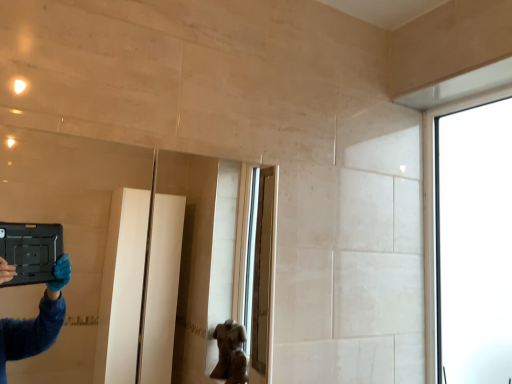
Measure the distance between point (93, 259) and camera.

They are 8.76 feet apart.

Locate an element on the screen. The image size is (512, 384). clear glass mirror at upper left is located at coordinates (83, 244).

What do you see at coordinates (83, 244) in the screenshot? I see `clear glass mirror at upper left` at bounding box center [83, 244].

What is the approximate width of transparent glass window at upper right?

It is 2.15 inches.

Describe the element at coordinates (471, 242) in the screenshot. I see `transparent glass window at upper right` at that location.

Find the location of a particular element. transparent glass window at upper right is located at coordinates (471, 242).

Locate an element on the screen. This screenshot has height=384, width=512. clear glass mirror at upper left is located at coordinates (83, 244).

Considering the relative positions of clear glass mirror at upper left and transparent glass window at upper right in the image provided, is clear glass mirror at upper left to the left of transparent glass window at upper right from the viewer's perspective?

Indeed, clear glass mirror at upper left is positioned on the left side of transparent glass window at upper right.

Does clear glass mirror at upper left lie behind transparent glass window at upper right?

That is False.

Considering the points (41, 371) and (452, 377), which point is behind, point (41, 371) or point (452, 377)?

The point (41, 371) is more distant.

From the image's perspective, is clear glass mirror at upper left over transparent glass window at upper right?

No, from the image's perspective, clear glass mirror at upper left is not on top of transparent glass window at upper right.

From a real-world perspective, which object stands above the other?

transparent glass window at upper right is physically above.

Considering the sizes of objects clear glass mirror at upper left and transparent glass window at upper right in the image provided, who is wider, clear glass mirror at upper left or transparent glass window at upper right?

clear glass mirror at upper left is wider.

Which of these two, clear glass mirror at upper left or transparent glass window at upper right, stands shorter?

clear glass mirror at upper left is shorter.

Considering the relative sizes of clear glass mirror at upper left and transparent glass window at upper right in the image provided, is clear glass mirror at upper left bigger than transparent glass window at upper right?

Yes, clear glass mirror at upper left is bigger than transparent glass window at upper right.

Which is correct: clear glass mirror at upper left is inside transparent glass window at upper right, or outside of it?

clear glass mirror at upper left exists outside the volume of transparent glass window at upper right.

Is clear glass mirror at upper left placed right next to transparent glass window at upper right?

clear glass mirror at upper left and transparent glass window at upper right are not in contact.

Is clear glass mirror at upper left looking in the opposite direction of transparent glass window at upper right?

No.

Find the location of a particular element. Image resolution: width=512 pixels, height=384 pixels. mirror below the transparent glass window at upper right (from the image's perspective) is located at coordinates (83, 244).

Which is more to the left, transparent glass window at upper right or clear glass mirror at upper left?

clear glass mirror at upper left is more to the left.

Relative to clear glass mirror at upper left, is transparent glass window at upper right in front or behind?

Clearly, transparent glass window at upper right is behind clear glass mirror at upper left.

Is point (449, 245) closer or farther from the camera than point (101, 355)?

Point (449, 245) appears to be closer to the viewer than point (101, 355).

From the image's perspective, does transparent glass window at upper right appear higher than clear glass mirror at upper left?

Correct, transparent glass window at upper right appears higher than clear glass mirror at upper left in the image.

From a real-world perspective, is transparent glass window at upper right positioned above or below clear glass mirror at upper left?

transparent glass window at upper right is situated higher than clear glass mirror at upper left in the real world.

Considering the relative sizes of transparent glass window at upper right and clear glass mirror at upper left in the image provided, is transparent glass window at upper right wider than clear glass mirror at upper left?

In fact, transparent glass window at upper right might be narrower than clear glass mirror at upper left.

From the picture: Considering the sizes of transparent glass window at upper right and clear glass mirror at upper left in the image, is transparent glass window at upper right taller or shorter than clear glass mirror at upper left?

transparent glass window at upper right is taller than clear glass mirror at upper left.

Which of these two, transparent glass window at upper right or clear glass mirror at upper left, is bigger?

Bigger between the two is clear glass mirror at upper left.

Would you say transparent glass window at upper right is outside clear glass mirror at upper left?

Absolutely, transparent glass window at upper right is external to clear glass mirror at upper left.

Are transparent glass window at upper right and clear glass mirror at upper left far apart?

That's right, there is a large distance between transparent glass window at upper right and clear glass mirror at upper left.

Is clear glass mirror at upper left at the back of transparent glass window at upper right?

No, clear glass mirror at upper left is not at the back of transparent glass window at upper right.

What's the angular difference between transparent glass window at upper right and clear glass mirror at upper left's facing directions?

There is a 89-degree angle between the facing directions of transparent glass window at upper right and clear glass mirror at upper left.

How far apart are transparent glass window at upper right and clear glass mirror at upper left?

1.60 meters.

Locate an element on the screen. The width and height of the screenshot is (512, 384). mirror lying in front of the transparent glass window at upper right is located at coordinates (83, 244).

The image size is (512, 384). I want to click on mirror located below the transparent glass window at upper right (from the image's perspective), so click(83, 244).

Where is `window that appears above the clear glass mirror at upper left (from the image's perspective)`? The height and width of the screenshot is (384, 512). window that appears above the clear glass mirror at upper left (from the image's perspective) is located at coordinates (471, 242).